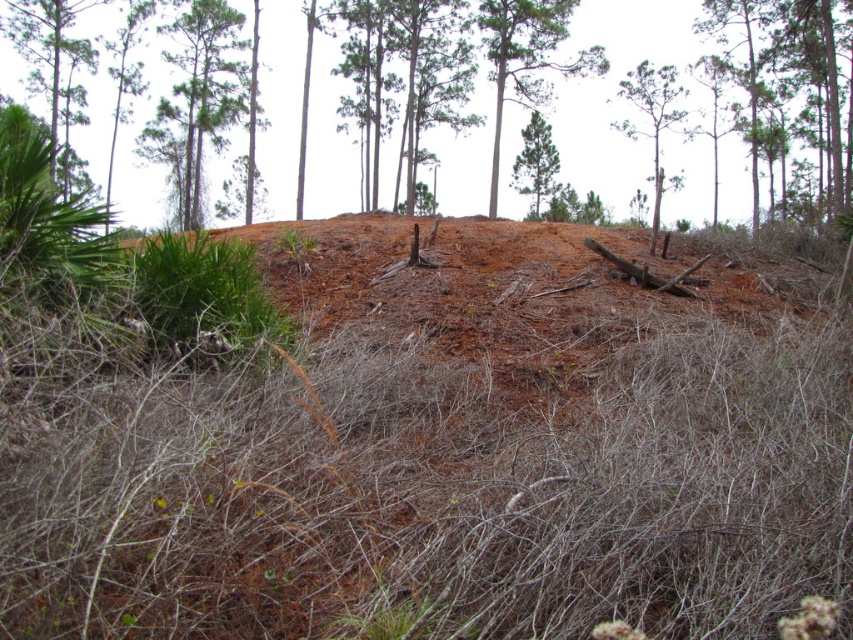
Question: Which of the following is the closest to the observer?

Choices:
 (A) (625, 74)
 (B) (148, 68)
 (C) (496, 170)
 (D) (196, 132)

Answer: (C)

Question: Does green leafy tree at upper left come in front of green matte tree at upper center?

Choices:
 (A) no
 (B) yes

Answer: (A)

Question: Which point appears farthest from the camera in this image?

Choices:
 (A) (523, 164)
 (B) (579, 60)
 (C) (328, 157)
 (D) (677, 88)

Answer: (C)

Question: Can you confirm if green leafy tree at upper left is positioned above green matte tree at upper center?

Choices:
 (A) yes
 (B) no

Answer: (B)

Question: Which of the following is the closest to the observer?

Choices:
 (A) (187, 157)
 (B) (659, 157)

Answer: (A)

Question: Is green leafy tree at upper left bigger than green matte tree at center?

Choices:
 (A) yes
 (B) no

Answer: (A)